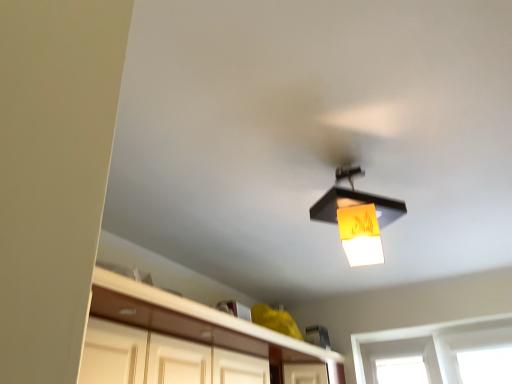
This screenshot has height=384, width=512. Identify the location of matte black lampshade at upper center. (357, 217).

The width and height of the screenshot is (512, 384). Describe the element at coordinates (357, 217) in the screenshot. I see `matte black lampshade at upper center` at that location.

Image resolution: width=512 pixels, height=384 pixels. What do you see at coordinates (187, 342) in the screenshot? I see `white glossy cabinetry at lower center` at bounding box center [187, 342].

At what (x,y) coordinates should I click in order to perform the action: click on white glossy cabinetry at lower center. Please return your answer as a coordinate pair (x, y). This screenshot has width=512, height=384. Looking at the image, I should click on (187, 342).

Measure the distance between white glossy cabinetry at lower center and camera.

white glossy cabinetry at lower center and camera are 1.27 meters apart.

Image resolution: width=512 pixels, height=384 pixels. I want to click on matte black lampshade at upper center, so click(357, 217).

Which is more to the left, white glossy cabinetry at lower center or matte black lampshade at upper center?

white glossy cabinetry at lower center.

Relative to matte black lampshade at upper center, is white glossy cabinetry at lower center in front or behind?

Clearly, white glossy cabinetry at lower center is in front of matte black lampshade at upper center.

Does point (315, 359) appear closer or farther from the camera than point (323, 200)?

Point (315, 359).

From the image's perspective, which one is positioned lower, white glossy cabinetry at lower center or matte black lampshade at upper center?

white glossy cabinetry at lower center appears lower in the image.

From a real-world perspective, is white glossy cabinetry at lower center positioned above or below matte black lampshade at upper center?

In terms of real-world spatial position, white glossy cabinetry at lower center is below matte black lampshade at upper center.

Does white glossy cabinetry at lower center have a greater width compared to matte black lampshade at upper center?

Indeed, white glossy cabinetry at lower center has a greater width compared to matte black lampshade at upper center.

Considering the sizes of white glossy cabinetry at lower center and matte black lampshade at upper center in the image, is white glossy cabinetry at lower center taller or shorter than matte black lampshade at upper center?

Clearly, white glossy cabinetry at lower center is shorter compared to matte black lampshade at upper center.

Is white glossy cabinetry at lower center bigger or smaller than matte black lampshade at upper center?

white glossy cabinetry at lower center is bigger than matte black lampshade at upper center.

Do you think white glossy cabinetry at lower center is within matte black lampshade at upper center, or outside of it?

The correct answer is: outside.

Is the surface of white glossy cabinetry at lower center in direct contact with matte black lampshade at upper center?

white glossy cabinetry at lower center and matte black lampshade at upper center are clearly separated.

Is white glossy cabinetry at lower center facing towards matte black lampshade at upper center?

No, white glossy cabinetry at lower center is not oriented towards matte black lampshade at upper center.

The height and width of the screenshot is (384, 512). I want to click on cabinetry that appears below the matte black lampshade at upper center (from the image's perspective), so click(x=187, y=342).

Visually, is matte black lampshade at upper center positioned to the left or to the right of white glossy cabinetry at lower center?

From the image, it's evident that matte black lampshade at upper center is to the right of white glossy cabinetry at lower center.

Which object is more forward, matte black lampshade at upper center or white glossy cabinetry at lower center?

white glossy cabinetry at lower center.

Which is less distant, (358, 212) or (257, 365)?

Point (358, 212) appears to be closer to the viewer than point (257, 365).

From the image's perspective, which is above, matte black lampshade at upper center or white glossy cabinetry at lower center?

matte black lampshade at upper center appears higher in the image.

From a real-world perspective, is matte black lampshade at upper center located beneath white glossy cabinetry at lower center?

Incorrect, from a real-world perspective, matte black lampshade at upper center is higher than white glossy cabinetry at lower center.

Looking at this image, which object is thinner, matte black lampshade at upper center or white glossy cabinetry at lower center?

With smaller width is matte black lampshade at upper center.

Considering the sizes of objects matte black lampshade at upper center and white glossy cabinetry at lower center in the image provided, who is taller, matte black lampshade at upper center or white glossy cabinetry at lower center?

matte black lampshade at upper center is taller.

Looking at the image, does matte black lampshade at upper center seem bigger or smaller compared to white glossy cabinetry at lower center?

matte black lampshade at upper center is smaller than white glossy cabinetry at lower center.

Is matte black lampshade at upper center inside or outside of white glossy cabinetry at lower center?

matte black lampshade at upper center is outside white glossy cabinetry at lower center.

Is matte black lampshade at upper center directly adjacent to white glossy cabinetry at lower center?

No, matte black lampshade at upper center is not touching white glossy cabinetry at lower center.

Based on the photo, is matte black lampshade at upper center facing towards white glossy cabinetry at lower center?

No.

How different are the orientations of matte black lampshade at upper center and white glossy cabinetry at lower center in degrees?

matte black lampshade at upper center and white glossy cabinetry at lower center are facing 82.7 degrees away from each other.

I want to click on cabinetry in front of the matte black lampshade at upper center, so click(187, 342).

This screenshot has width=512, height=384. What are the coordinates of `lamp above the white glossy cabinetry at lower center (from the image's perspective)` in the screenshot? It's located at (357, 217).

You are a GUI agent. You are given a task and a screenshot of the screen. Output one action in this format:
    pyautogui.click(x=<x>, y=<y>)
    Task: Click on the cabinetry to the left of matte black lampshade at upper center
    The image size is (512, 384).
    Given the screenshot: What is the action you would take?
    pyautogui.click(x=187, y=342)